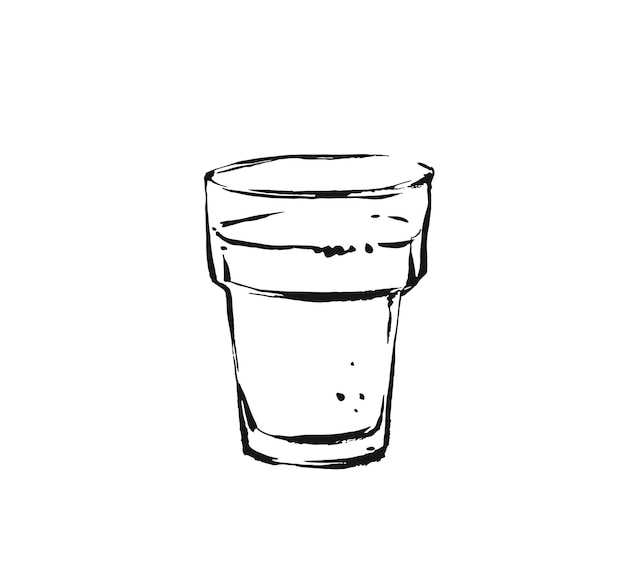
Help me find where a coaster would go in the image by pointing to them. Your answer should be formatted as a list of tuples, i.e. [(x1, y1), (x2, y2), ...], where each tuple contains the x and y coordinates of a point satisfying the conditions above.

[(320, 470)]